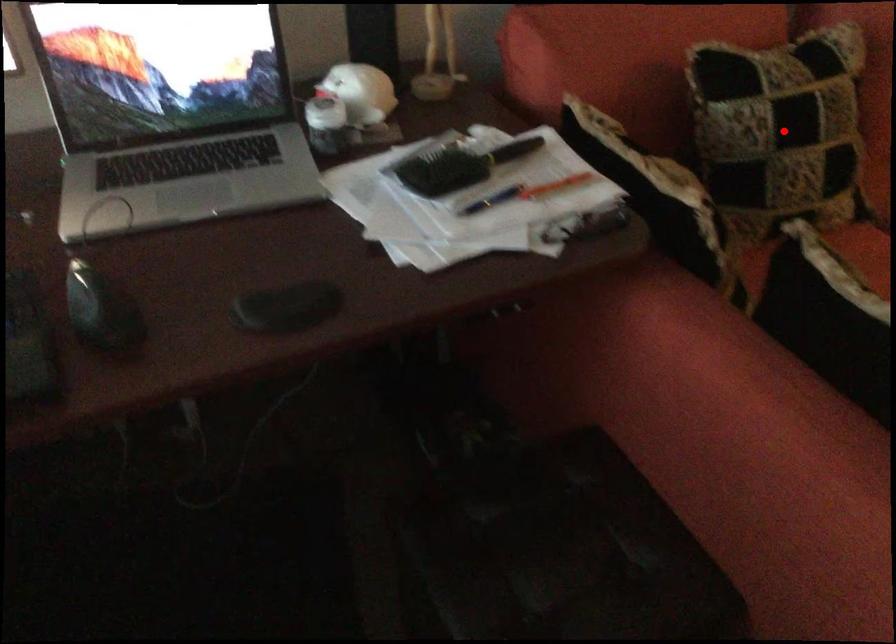
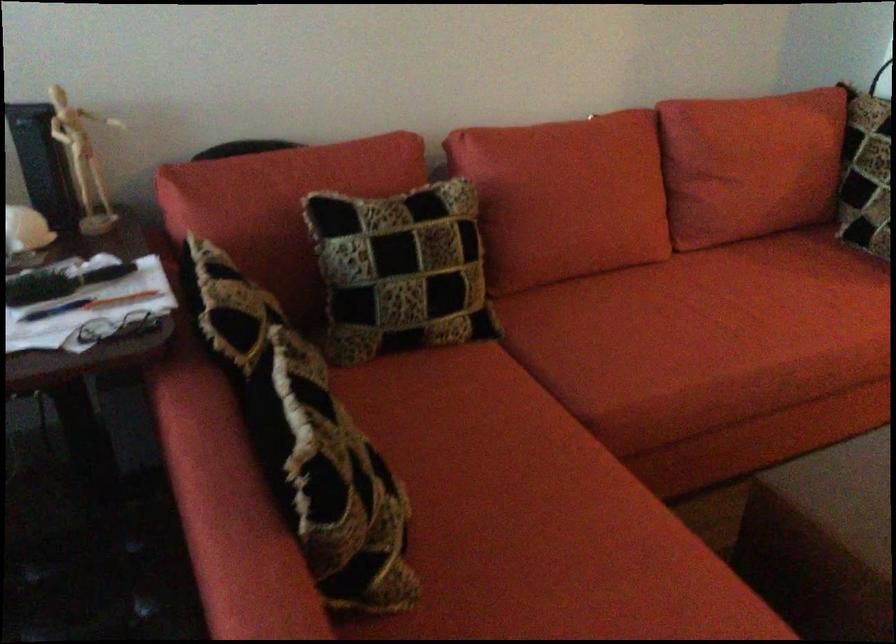
Where in the second image is the point corresponding to the highlighted location from the first image?

(385, 263)